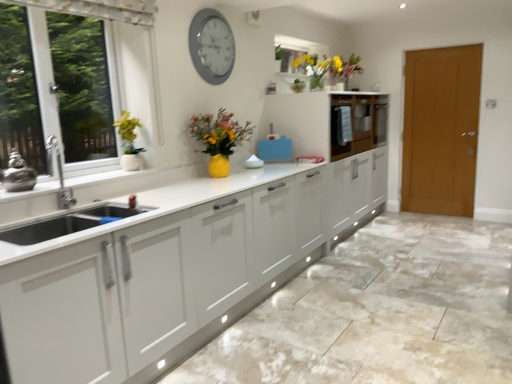
What are the coordinates of `white marble granite at lower center` in the screenshot? It's located at (379, 312).

What is the approximate width of matte white cabinet at center, marked as the first cabinetry in a front-to-back arrangement?

matte white cabinet at center, marked as the first cabinetry in a front-to-back arrangement, is 26.11 inches in width.

What do you see at coordinates (323, 121) in the screenshot? I see `matte white cabinet at center, which is the 2th cabinetry in back-to-front order` at bounding box center [323, 121].

What do you see at coordinates (211, 46) in the screenshot?
I see `silver metallic clock at upper center` at bounding box center [211, 46].

At what (x,y) coordinates should I click in order to perform the action: click on matte white cabinet at center, the 1th cabinetry positioned from the back. Please return your answer as a coordinate pair (x, y). The width and height of the screenshot is (512, 384). Looking at the image, I should click on (357, 123).

Between silver metallic clock at upper center and matte white cabinet at center, which is the 2th cabinetry in back-to-front order, which one is positioned behind?

matte white cabinet at center, which is the 2th cabinetry in back-to-front order, is further from the camera.

Which is in front, point (218, 65) or point (295, 105)?

The point (218, 65) is in front.

Could you tell me if silver metallic clock at upper center is turned towards matte white cabinet at center, marked as the first cabinetry in a front-to-back arrangement?

No, silver metallic clock at upper center is not aimed at matte white cabinet at center, marked as the first cabinetry in a front-to-back arrangement.

Looking at this image, does matte white cabinet at center, the 1th cabinetry positioned from the back, turn towards matte white cabinet at center, marked as the first cabinetry in a front-to-back arrangement?

Yes, matte white cabinet at center, the 1th cabinetry positioned from the back, is facing matte white cabinet at center, marked as the first cabinetry in a front-to-back arrangement.

Considering the relative positions of matte white cabinet at center, the 1th cabinetry positioned from the back, and matte white cabinet at center, which is the 2th cabinetry in back-to-front order, in the image provided, is matte white cabinet at center, the 1th cabinetry positioned from the back, to the left of matte white cabinet at center, which is the 2th cabinetry in back-to-front order, from the viewer's perspective?

No.

Relative to matte white cabinet at center, marked as the first cabinetry in a front-to-back arrangement, is matte white cabinet at center, arranged as the second cabinetry when viewed from the front, in front or behind?

Visually, matte white cabinet at center, arranged as the second cabinetry when viewed from the front, is located behind matte white cabinet at center, marked as the first cabinetry in a front-to-back arrangement.

You are a GUI agent. You are given a task and a screenshot of the screen. Output one action in this format:
    pyautogui.click(x=<x>, y=<y>)
    Task: Click on the cabinetry on the left of matte white cabinet at center, the 1th cabinetry positioned from the back
    This screenshot has height=384, width=512.
    Given the screenshot: What is the action you would take?
    pyautogui.click(x=323, y=121)

Measure the distance between silver metallic clock at upper center and white marble granite at lower center.

silver metallic clock at upper center and white marble granite at lower center are 6.76 feet apart from each other.

Does silver metallic clock at upper center appear on the right side of white marble granite at lower center?

In fact, silver metallic clock at upper center is to the left of white marble granite at lower center.

This screenshot has height=384, width=512. Identify the location of granite on the right of the silver metallic clock at upper center. (379, 312).

Does silver metallic clock at upper center have a lesser width compared to white marble granite at lower center?

Yes.

Is brown wooden door at right inside white marble granite at lower center?

No, white marble granite at lower center does not contain brown wooden door at right.

Consider the image. From a real-world perspective, between white marble granite at lower center and brown wooden door at right, who is vertically higher?

From a 3D spatial view, brown wooden door at right is above.

Is white marble granite at lower center aimed at brown wooden door at right?

No, white marble granite at lower center is not oriented towards brown wooden door at right.

Considering their positions, is white marble granite at lower center located in front of or behind brown wooden door at right?

Clearly, white marble granite at lower center is in front of brown wooden door at right.

From the image's perspective, is brown wooden door at right above or below white marble granite at lower center?

Based on their image positions, brown wooden door at right is located above white marble granite at lower center.

Who is shorter, brown wooden door at right or white marble granite at lower center?

white marble granite at lower center.

Is point (457, 123) behind point (325, 285)?

Yes, it is.

Does brown wooden door at right have a greater width compared to white marble granite at lower center?

Incorrect, the width of brown wooden door at right does not surpass that of white marble granite at lower center.

Considering the positions of objects white marble granite at lower center and matte white cabinet at center, the 1th cabinetry positioned from the back, in the image provided, who is more to the right, white marble granite at lower center or matte white cabinet at center, the 1th cabinetry positioned from the back,?

From the viewer's perspective, matte white cabinet at center, the 1th cabinetry positioned from the back, appears more on the right side.

What's the angular difference between white marble granite at lower center and matte white cabinet at center, the 1th cabinetry positioned from the back,'s facing directions?

They differ by 89.9 degrees in their facing directions.

Is white marble granite at lower center oriented away from matte white cabinet at center, arranged as the second cabinetry when viewed from the front?

white marble granite at lower center does not have its back to matte white cabinet at center, arranged as the second cabinetry when viewed from the front.

What are the coordinates of `granite located underneath the matte white cabinet at center, the 1th cabinetry positioned from the back (from a real-world perspective)` in the screenshot? It's located at (379, 312).

From a real-world perspective, who is located lower, matte white cabinet at center, the 1th cabinetry positioned from the back, or white marble granite at lower center?

In real-world perspective, white marble granite at lower center is lower.

Is white marble granite at lower center at the back of matte white cabinet at center, arranged as the second cabinetry when viewed from the front?

No, white marble granite at lower center is not at the back of matte white cabinet at center, arranged as the second cabinetry when viewed from the front.

Can you confirm if matte white cabinet at center, the 1th cabinetry positioned from the back, is shorter than white marble granite at lower center?

No, matte white cabinet at center, the 1th cabinetry positioned from the back, is not shorter than white marble granite at lower center.

Where is `clock above the matte white cabinet at center, marked as the first cabinetry in a front-to-back arrangement (from a real-world perspective)`? Image resolution: width=512 pixels, height=384 pixels. clock above the matte white cabinet at center, marked as the first cabinetry in a front-to-back arrangement (from a real-world perspective) is located at coordinates (211, 46).

Locate an element on the screen. The width and height of the screenshot is (512, 384). cabinetry on the right of matte white cabinet at center, which is the 2th cabinetry in back-to-front order is located at coordinates (357, 123).

Based on their spatial positions, is silver metallic clock at upper center or matte white cabinet at center, which is the 2th cabinetry in back-to-front order, further from matte white cabinet at center, the 1th cabinetry positioned from the back?

Among the two, silver metallic clock at upper center is located further to matte white cabinet at center, the 1th cabinetry positioned from the back.

From the image, which object appears to be nearer to brown wooden door at right, matte white cabinet at center, the 1th cabinetry positioned from the back, or yellow matte vase at upper center?

matte white cabinet at center, the 1th cabinetry positioned from the back, is positioned closer to the anchor brown wooden door at right.

Based on their spatial positions, is silver metallic clock at upper center or brown wooden door at right closer to yellow matte vase at upper center?

The object closer to yellow matte vase at upper center is silver metallic clock at upper center.

Which object lies further to the anchor point yellow matte vase at upper center, matte white cabinet at center, the 1th cabinetry positioned from the back, or matte white cabinet at center, which is the 2th cabinetry in back-to-front order?

matte white cabinet at center, the 1th cabinetry positioned from the back.

Which object lies further to the anchor point brown wooden door at right, white marble granite at lower center or yellow matte vase at upper center?

white marble granite at lower center lies further to brown wooden door at right than the other object.

Based on their spatial positions, is white marble granite at lower center or matte white cabinet at center, marked as the first cabinetry in a front-to-back arrangement, further from matte white cabinet at center, arranged as the second cabinetry when viewed from the front?

The object further to matte white cabinet at center, arranged as the second cabinetry when viewed from the front, is white marble granite at lower center.

Based on their spatial positions, is brown wooden door at right or matte white cabinet at center, marked as the first cabinetry in a front-to-back arrangement, closer to matte white cabinet at center, arranged as the second cabinetry when viewed from the front?

Based on the image, matte white cabinet at center, marked as the first cabinetry in a front-to-back arrangement, appears to be nearer to matte white cabinet at center, arranged as the second cabinetry when viewed from the front.

Based on their spatial positions, is silver metallic clock at upper center or matte white cabinet at center, which is the 2th cabinetry in back-to-front order, further from white marble granite at lower center?

Based on the image, silver metallic clock at upper center appears to be further to white marble granite at lower center.

Identify the location of cabinetry between silver metallic clock at upper center and matte white cabinet at center, arranged as the second cabinetry when viewed from the front, from front to back. (323, 121).

You are a GUI agent. You are given a task and a screenshot of the screen. Output one action in this format:
    pyautogui.click(x=<x>, y=<y>)
    Task: Click on the door between white marble granite at lower center and matte white cabinet at center, the 1th cabinetry positioned from the back, in the front-back direction
    The height and width of the screenshot is (384, 512).
    Given the screenshot: What is the action you would take?
    pyautogui.click(x=441, y=129)

Where is `cabinetry between white marble granite at lower center and matte white cabinet at center, arranged as the second cabinetry when viewed from the front, in the front-back direction`? This screenshot has width=512, height=384. cabinetry between white marble granite at lower center and matte white cabinet at center, arranged as the second cabinetry when viewed from the front, in the front-back direction is located at coordinates (323, 121).

Find the location of a particular element. The width and height of the screenshot is (512, 384). floral arrangement between silver metallic clock at upper center and brown wooden door at right in the horizontal direction is located at coordinates (318, 68).